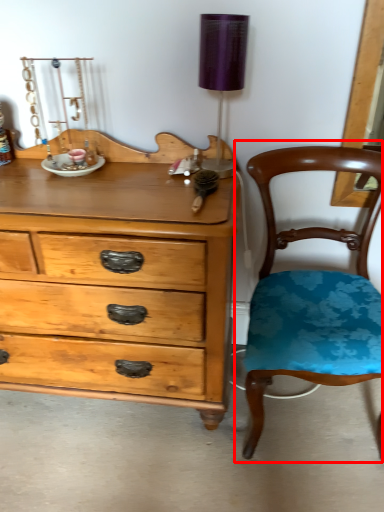
Question: Considering the relative positions of chair (annotated by the red box) and table lamp in the image provided, where is chair (annotated by the red box) located with respect to the staircase?

Choices:
 (A) right
 (B) left

Answer: (A)